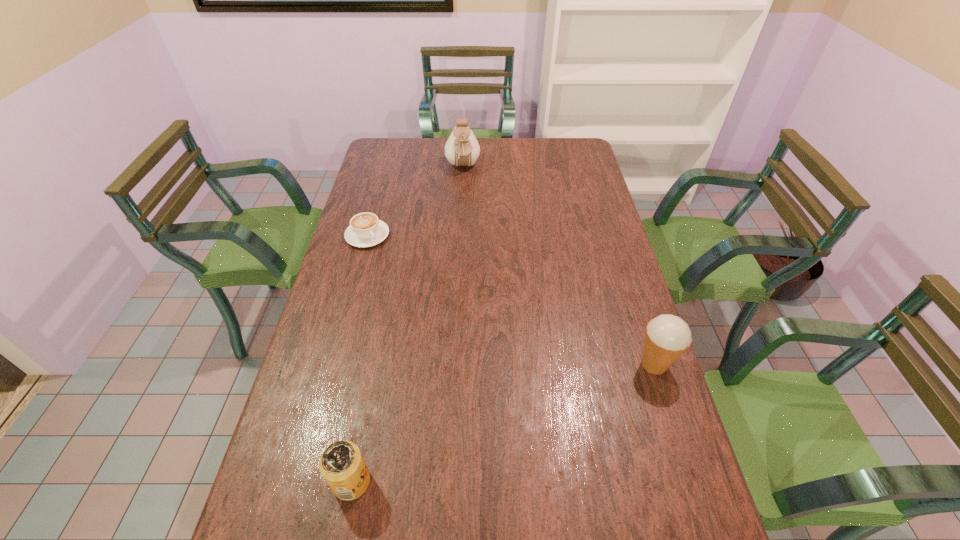
The height and width of the screenshot is (540, 960). I want to click on vacant space on the desktop that is between the second shortest object and the icecream and is positioned on the front-facing side of the third object from left to right, so click(x=480, y=431).

Locate an element on the screen. The image size is (960, 540). free space on the desktop that is between the nearest object and the rightmost object and is positioned on the side of the cappuccino with the handle is located at coordinates (513, 419).